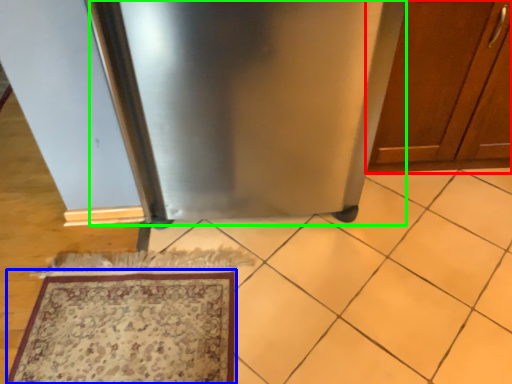
Question: Which object is positioned closest to cabinetry (highlighted by a red box)? Select from mat (highlighted by a blue box) and appliance (highlighted by a green box).

Choices:
 (A) mat
 (B) appliance

Answer: (B)